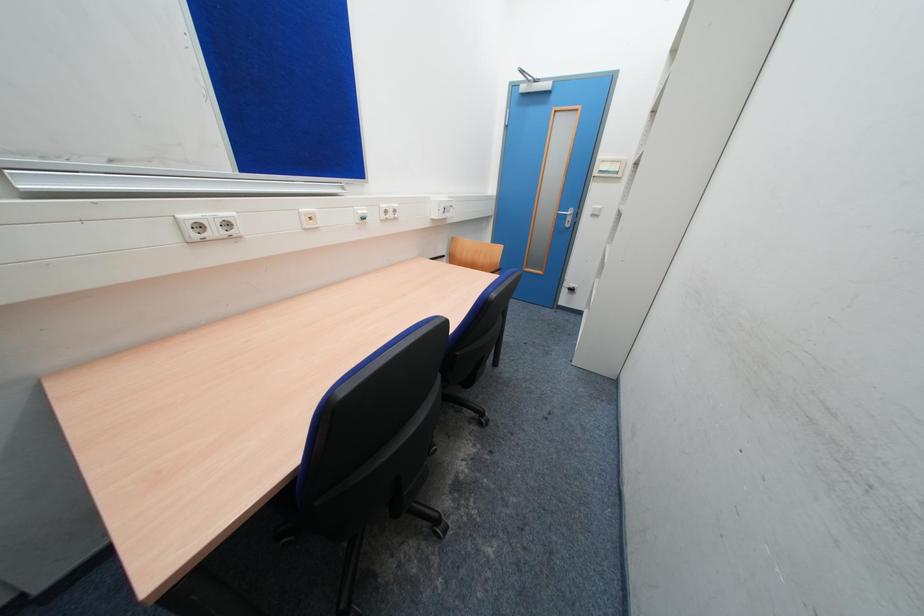
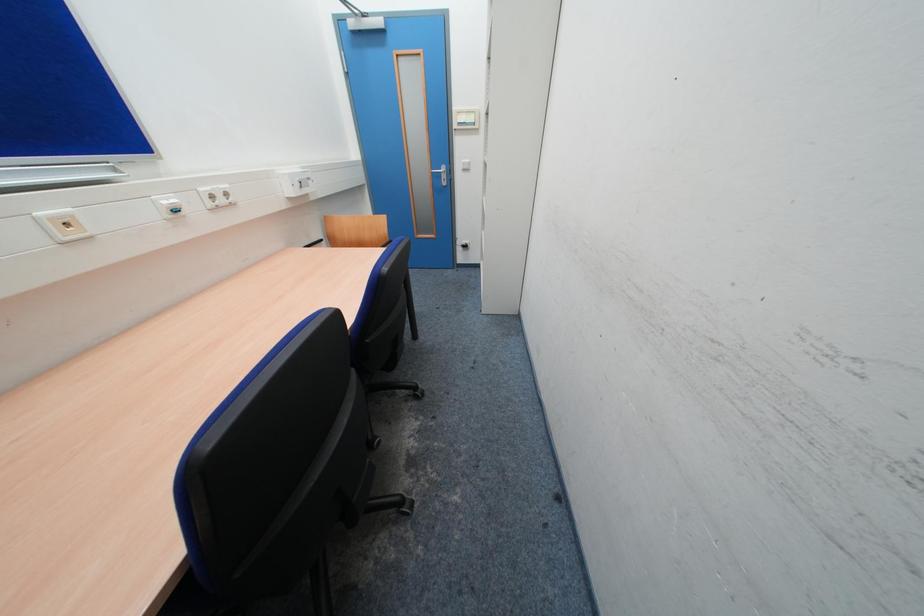
Question: Based on the continuous images, in which direction is the camera rotating? Reply with the corresponding letter.

Choices:
 (A) Left
 (B) Right
 (C) Up
 (D) Down

Answer: (B)